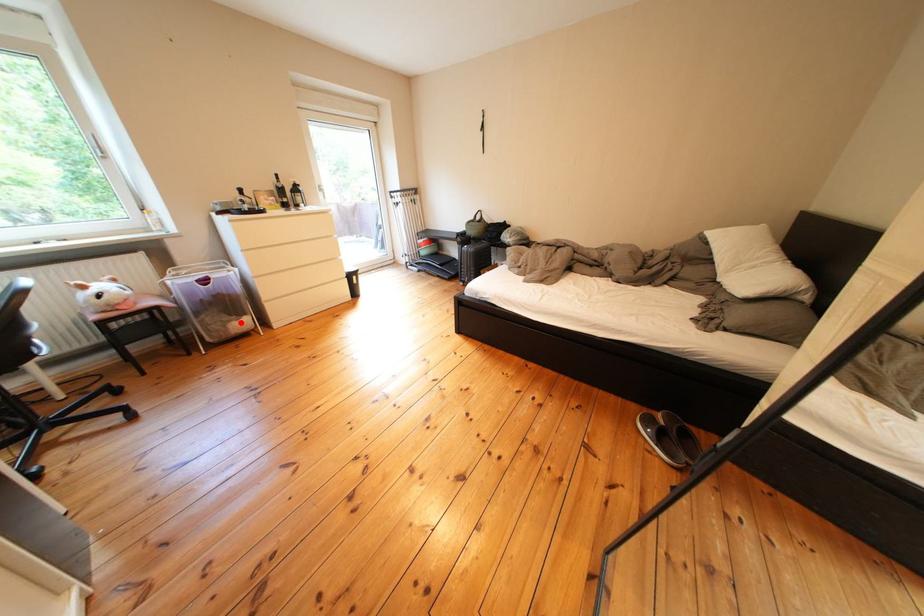
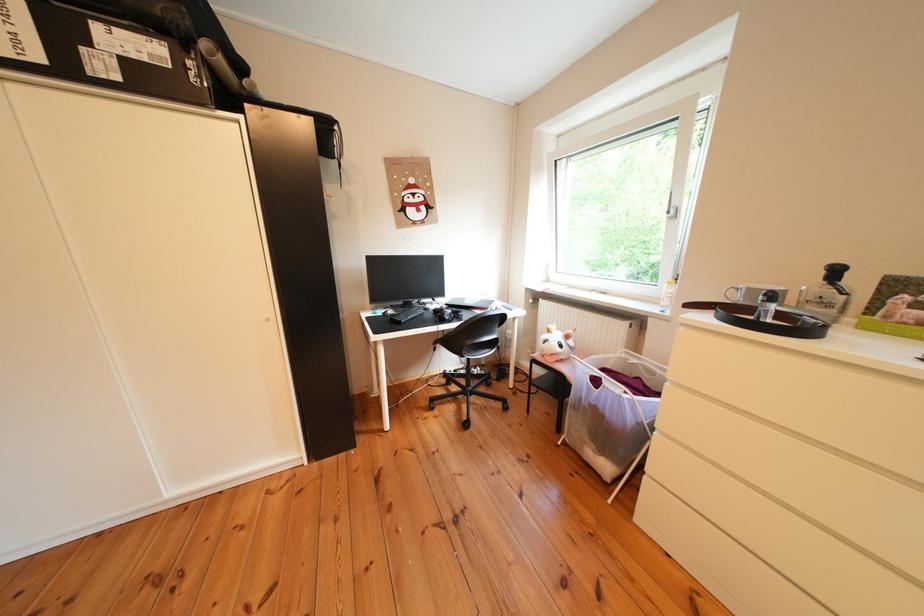
Question: I am providing you with two images of the same scene from different viewpoints. Image1 has a red point marked. In image2, the corresponding 3D location appears at what relative position? Reply with the corresponding letter.

Choices:
 (A) Closer
 (B) Farther

Answer: (B)